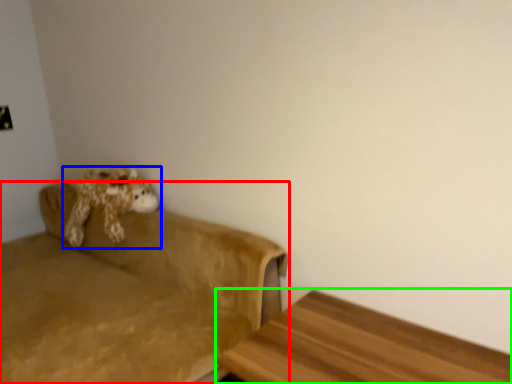
Question: Based on their relative distances, which object is nearer to studio couch (highlighted by a red box)? Choose from toy (highlighted by a blue box) and furniture (highlighted by a green box).

Choices:
 (A) toy
 (B) furniture

Answer: (A)